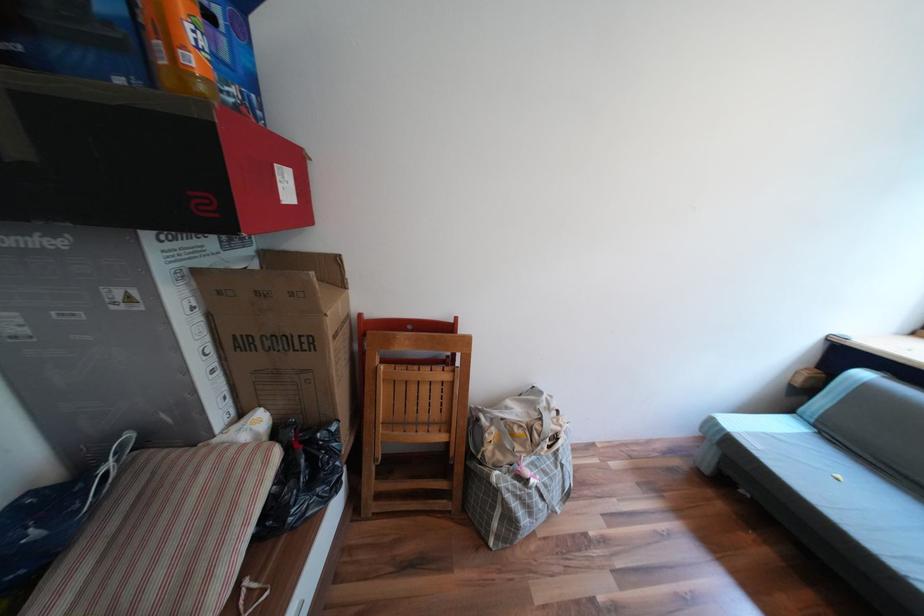
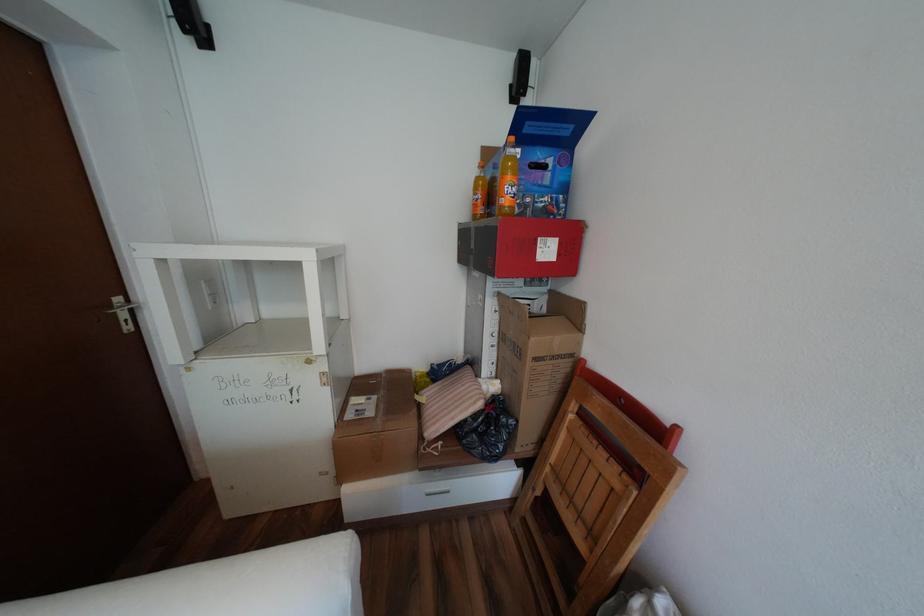
The point at (193,47) is marked in the first image. Where is the corresponding point in the second image?

(512, 197)